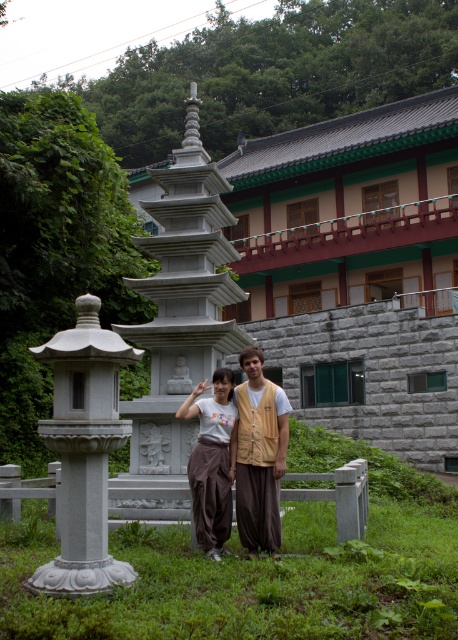
You are standing in front of the traditional Korean building and pagoda. There are two points marked in the scene. Which point, point (114, 580) or point (250, 404), is closer to you?

Point (114, 580) is closer to the viewer than point (250, 404).

You are a photographer standing in front of the traditional Korean building. You want to take a photo of the white stone lantern at left and the brown cotton pants at center. Based on their positions, which object will appear closer to the camera in the photo?

The white stone lantern at left is in front of the brown cotton pants at center, so it will appear closer to the camera in the photo.